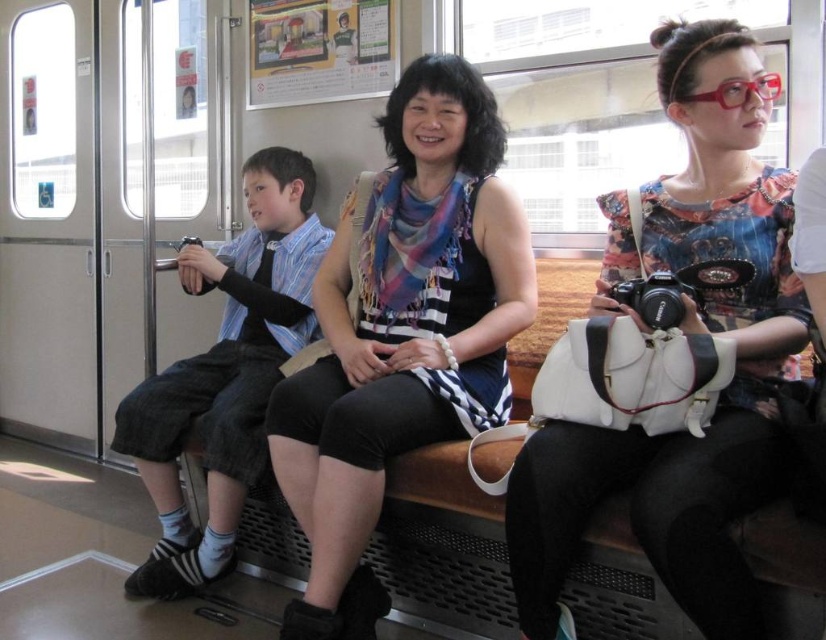
What is the position of the point with coordinates (691,328) in relation to the printed fabric shirt at center?

The point with coordinates (691,328) is located on the printed fabric shirt at center.

From the picture: You are a passenger in the subway car and want to know which item is narrower between the printed fabric shirt at center and the matte black scarf at center. Which one is it?

The printed fabric shirt at center is thinner than the matte black scarf at center, so the printed fabric shirt at center is narrower.

You are standing in the subway car and want to reach the matte black scarf at center and the denim shorts at left. Which item is closer to you?

The matte black scarf at center is closer to the viewer than the denim shorts at left.